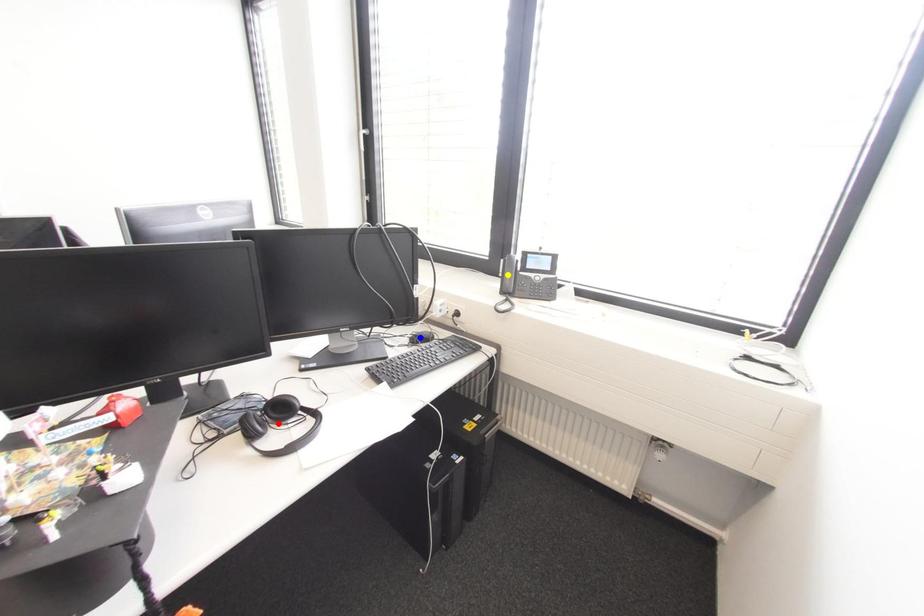
Order these from farthest to nearest:
blue point | red point | yellow point

yellow point < blue point < red point